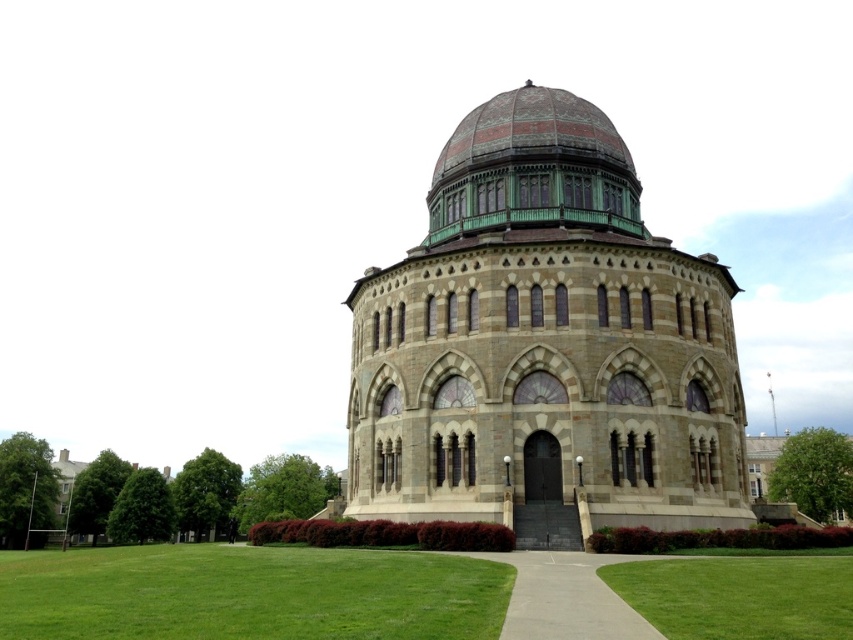
Question: Among these points, which one is farthest from the camera?

Choices:
 (A) (798, 612)
 (B) (430, 620)

Answer: (A)

Question: Is green grass at lower center thinner than green grass at lower right?

Choices:
 (A) no
 (B) yes

Answer: (A)

Question: Which is nearer to the bronze/golden dome at center?

Choices:
 (A) concrete at center
 (B) green grass at lower center

Answer: (A)

Question: Does stone church at center appear on the right side of concrete at center?

Choices:
 (A) no
 (B) yes

Answer: (B)

Question: Among these points, which one is farthest from the camera?

Choices:
 (A) (543, 170)
 (B) (534, 568)

Answer: (A)

Question: Does bronze/golden dome at center appear over concrete at center?

Choices:
 (A) yes
 (B) no

Answer: (A)